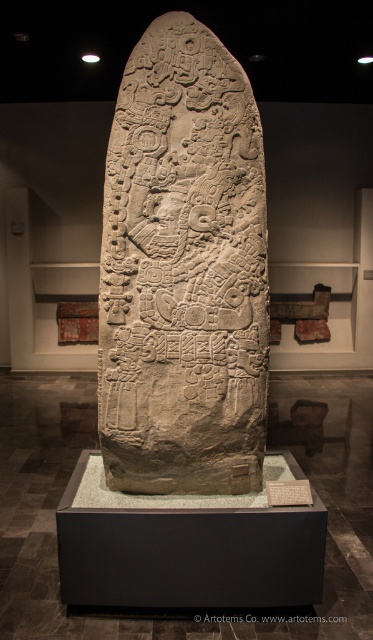
You are an archaeologist examining the stone stele in the museum. You notice two points on the stele labeled as point 1 at coordinates (126, 172) and point 2 at coordinates (245, 620). Which point is nearer to your viewpoint?

Point 1 at coordinates (126, 172) is closer to the viewer than point 2 at coordinates (245, 620).

You are a museum visitor standing in front of the carved stone stele at center and the white stone tablet at center. Which object is positioned to the left?

The carved stone stele at center is to the left of the white stone tablet at center.